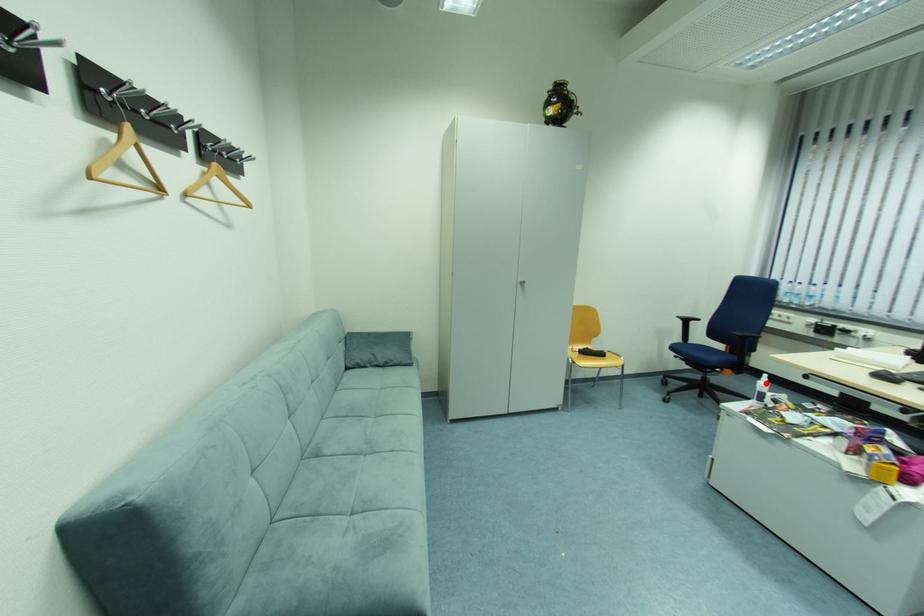
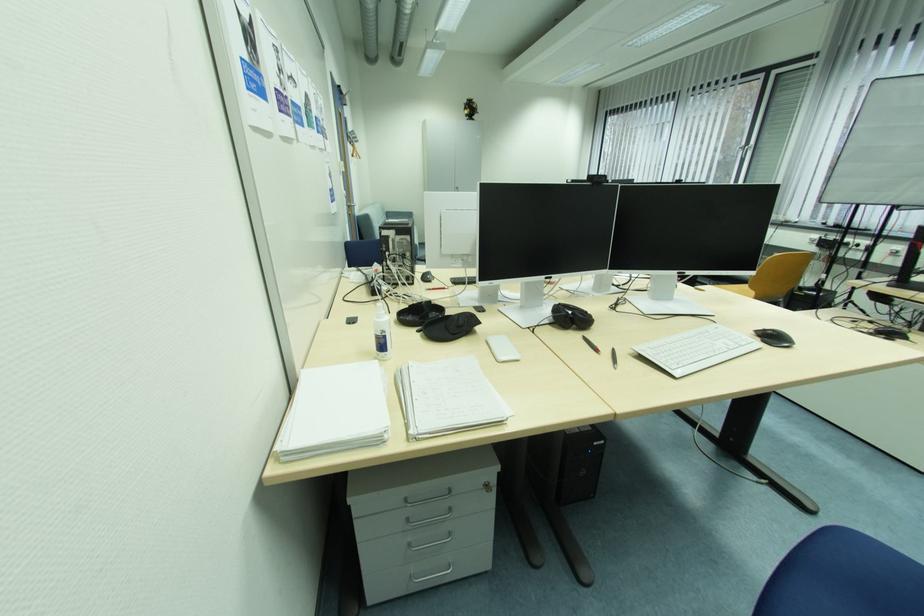
Question: I am providing you with two images of the same scene from different viewpoints. A red point is marked on the first image. Is the red point's position out of view in image 2?

Choices:
 (A) Yes
 (B) No

Answer: (A)